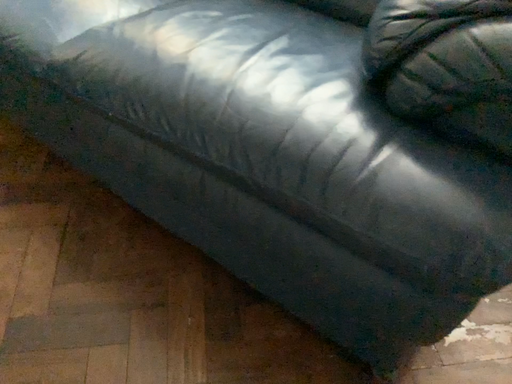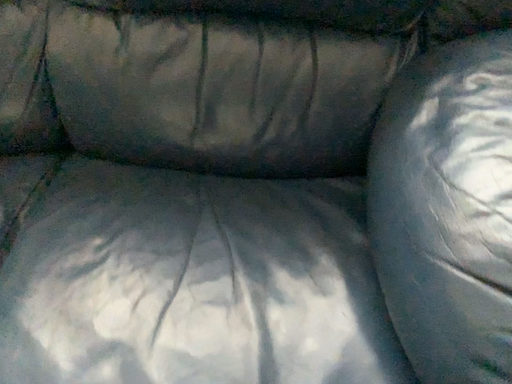
Question: How did the camera likely rotate when shooting the video?

Choices:
 (A) rotated left
 (B) rotated right

Answer: (B)